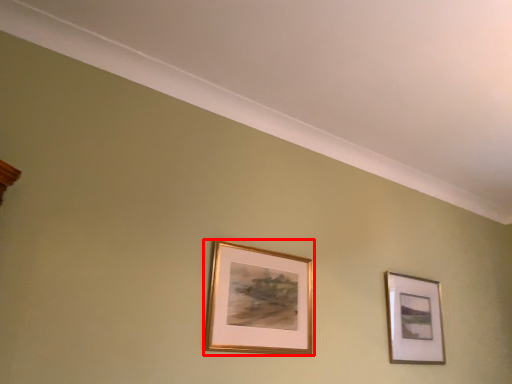
Question: Where is picture frame (annotated by the red box) located in relation to picture frame in the image?

Choices:
 (A) left
 (B) right

Answer: (A)